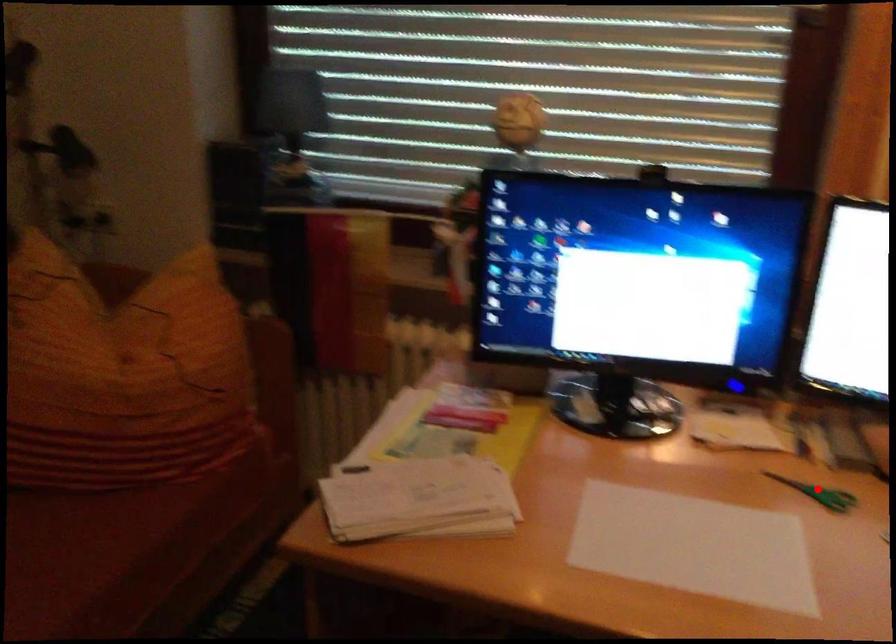
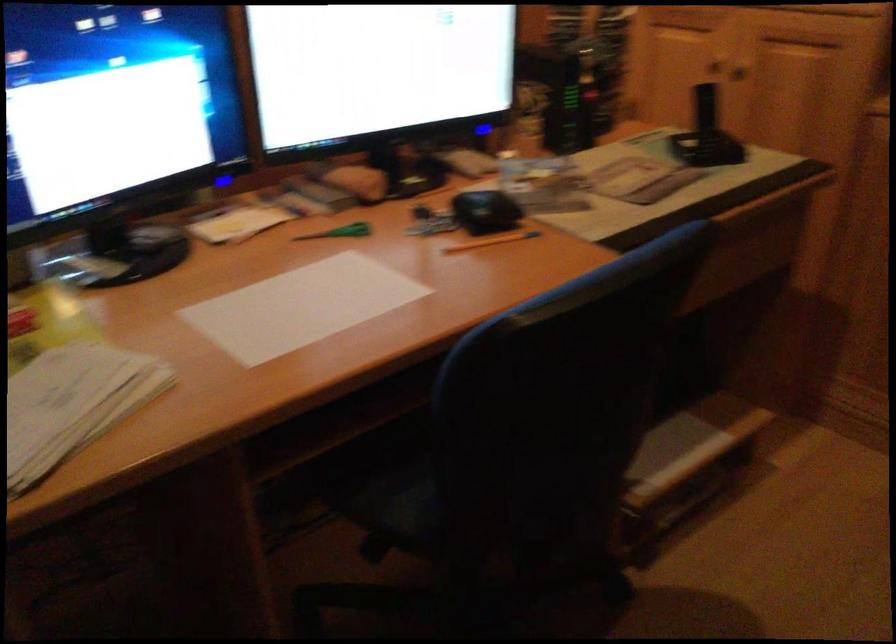
Question: I am providing you with two images of the same scene from different viewpoints. In image1, a red point is highlighted. Considering the same 3D point in image2, which of the following is correct?

Choices:
 (A) It is closer
 (B) It is farther

Answer: (B)